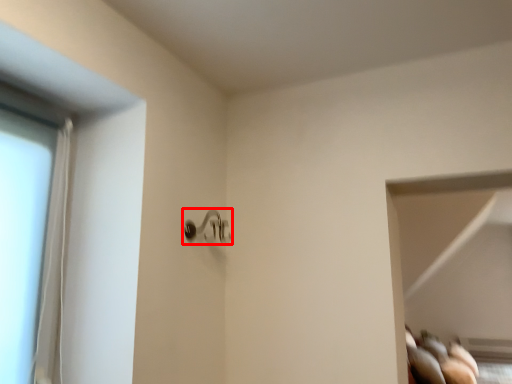
Question: From the image's perspective, where is door handle (annotated by the red box) located relative to glass door?

Choices:
 (A) below
 (B) above

Answer: (B)